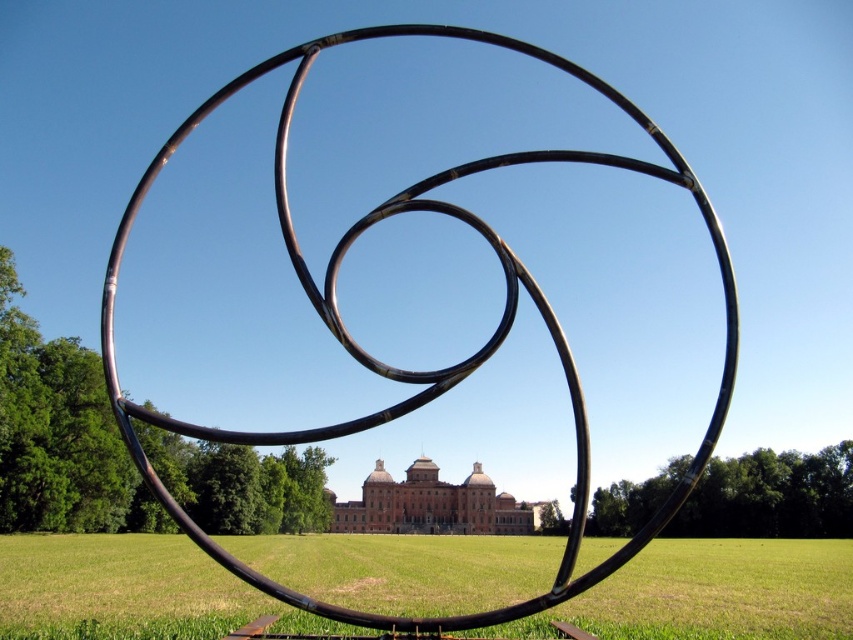
You are a gardener who needs to mow the green grass at center and polish the polished metal rings at center. Which object requires more attention to height? Explain why based on their positions.

The polished metal rings at center require more attention to height because the green grass at center is not as tall as them, indicating the rings are taller and may need careful polishing around their elevated parts.

You are a landscape architect planning to install a new pathway between the green grass at center and the polished metal rings at center. The pathway requires a minimum of 100 feet of space. Can the pathway be constructed between them?

The green grass at center and polished metal rings at center are 113.57 feet apart from each other, which exceeds the required 100 feet, so the pathway can be constructed between them.

You are standing in front of a large metal sculpture composed of three interlocking rings. Behind the sculpture, there is a grand historical building. You want to walk straight towards the building. How far will you have to walk to reach the green grass at center?

The distance of green grass at center from viewer is 306.80 feet, so you will have to walk 306.80 feet to reach the green grass at center.